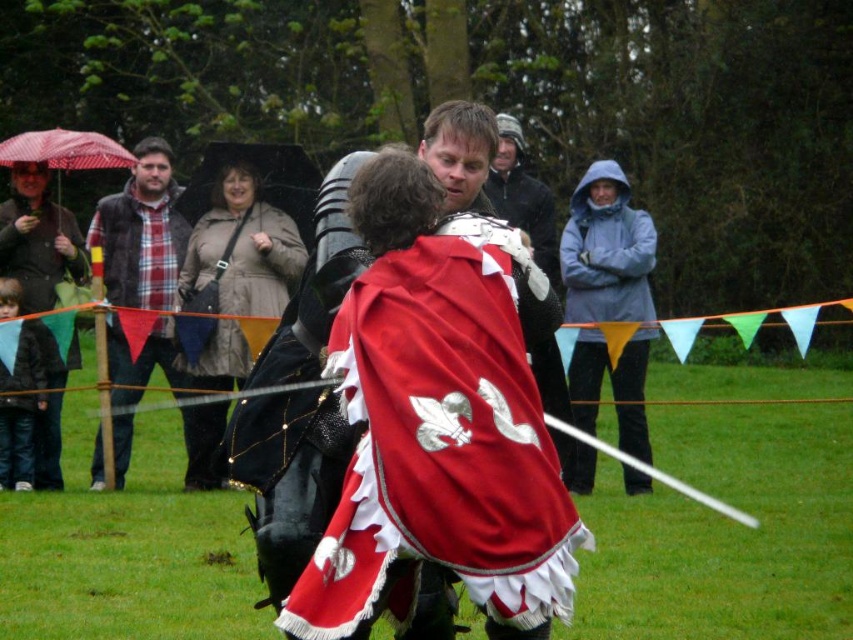
Which is below, matte black jacket at left or red velvet cape at center?

matte black jacket at left is lower down.

Can you confirm if matte black jacket at left is positioned to the left of red velvet cape at center?

Yes, matte black jacket at left is to the left of red velvet cape at center.

Is point (3, 240) in front of point (554, 410)?

No.

At what (x,y) coordinates should I click in order to perform the action: click on matte black jacket at left. Please return your answer as a coordinate pair (x, y). This screenshot has width=853, height=640. Looking at the image, I should click on [x=38, y=237].

Does gray fleece jacket at upper center lie in front of red fabric umbrella at center?

Yes.

Does gray fleece jacket at upper center appear on the left side of red fabric umbrella at center?

Incorrect, gray fleece jacket at upper center is not on the left side of red fabric umbrella at center.

Between point (596, 257) and point (311, 216), which one is positioned behind?

Positioned behind is point (311, 216).

Find the location of a particular element. The image size is (853, 640). gray fleece jacket at upper center is located at coordinates (606, 250).

Does velvet red cape at center have a larger size compared to red striped fabric umbrella at left?

Indeed, velvet red cape at center has a larger size compared to red striped fabric umbrella at left.

Between velvet red cape at center and red striped fabric umbrella at left, which one is positioned higher?

red striped fabric umbrella at left is higher up.

Which is in front, point (375, 593) or point (54, 144)?

Point (375, 593)

At what (x,y) coordinates should I click in order to perform the action: click on velvet red cape at center. Please return your answer as a coordinate pair (x, y). Image resolution: width=853 pixels, height=640 pixels. Looking at the image, I should click on (442, 440).